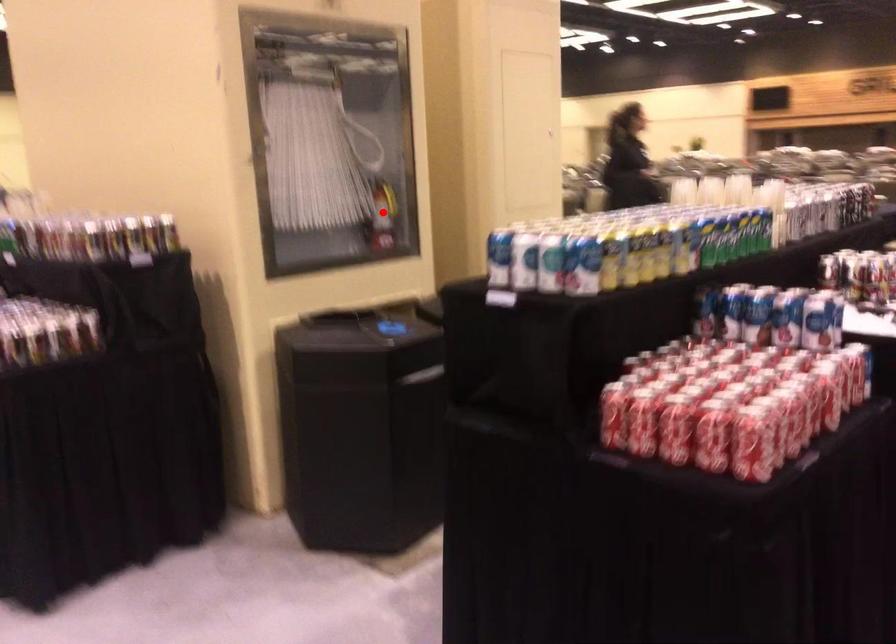
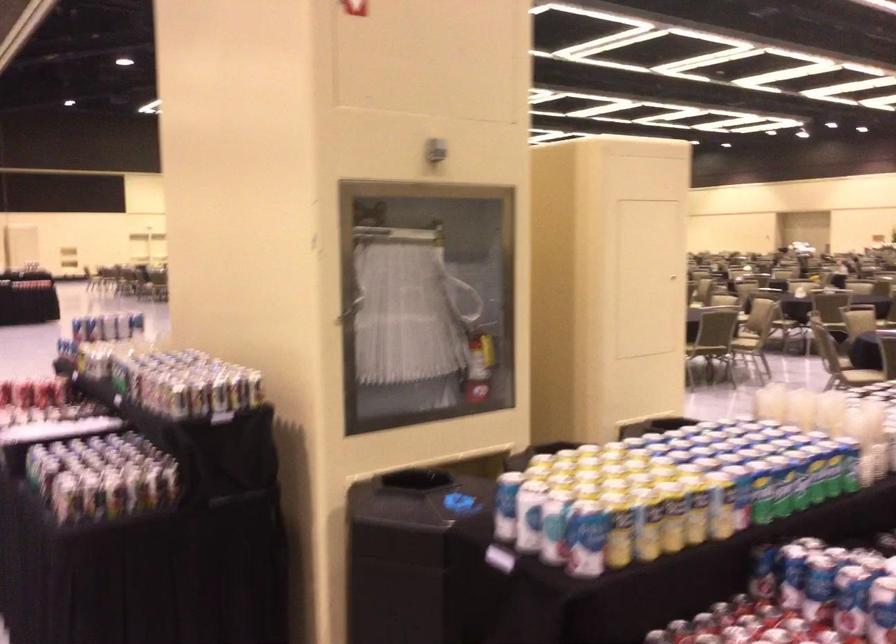
The point at the highlighted location is marked in the first image. Where is the corresponding point in the second image?

(478, 365)